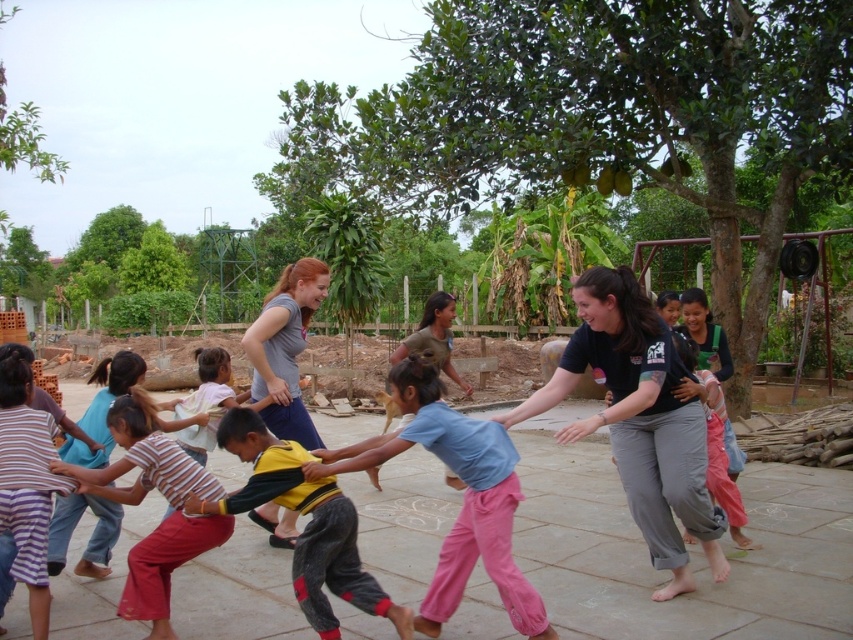
Question: Does striped fabric shirt at center appear over smooth skin hand at center?

Choices:
 (A) no
 (B) yes

Answer: (A)

Question: Can you confirm if light blue cotton shirt at center is positioned to the right of smooth skin hand at center?

Choices:
 (A) yes
 (B) no

Answer: (B)

Question: Observing the image, what is the correct spatial positioning of striped cotton shirt at center in reference to striped fabric shirt at center?

Choices:
 (A) below
 (B) above

Answer: (A)

Question: Which point is farther to the camera?

Choices:
 (A) (167, 477)
 (B) (41, 540)
 (C) (299, 497)
 (D) (577, 436)

Answer: (A)

Question: Which object is positioned closest to the striped cotton shirt at lower left?

Choices:
 (A) striped cotton shirt at center
 (B) smooth skin hand at center

Answer: (A)

Question: Estimate the real-world distances between objects in this image. Which object is closer to the striped cotton shirt at lower left?

Choices:
 (A) striped cotton shirt at center
 (B) smooth beige hand at center
 (C) smooth skin hand at center

Answer: (A)